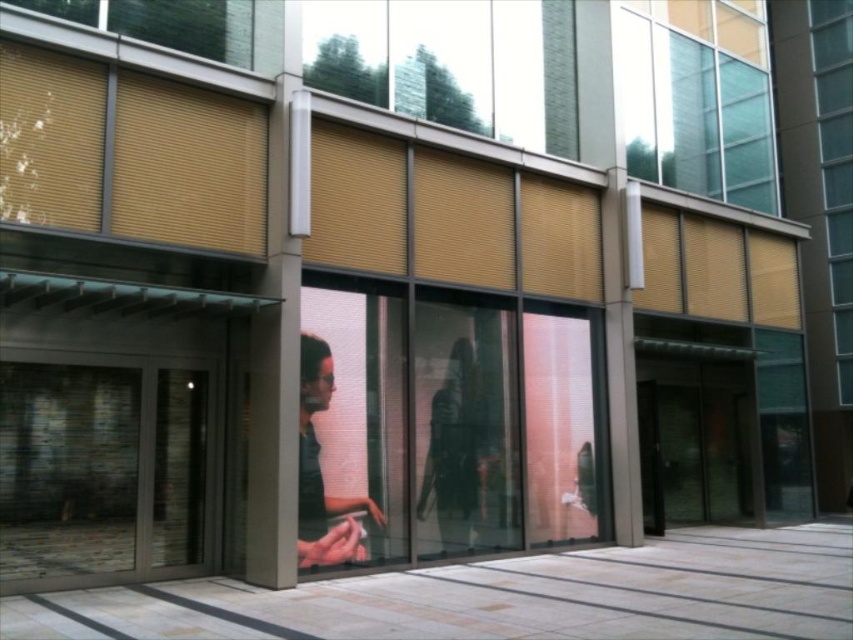
You are a window cleaner with a ladder that can reach up to 3 meters. You need to clean both the translucent glass window at upper right and the matte glass window at right. Can you clean both windows without moving the ladder?

The distance between the translucent glass window at upper right and the matte glass window at right is 3.22 meters. Since the ladder can only reach up to 3 meters, you cannot clean both windows without moving the ladder because the gap is wider than the ladder can cover.

You are an architect inspecting the building facade. You notice the translucent glass window at upper right and the matte glass window at right. Which window has a greater height?

The matte glass window at right is taller than the translucent glass window at upper right because the translucent glass window at upper right is not as tall as the matte glass window at right.